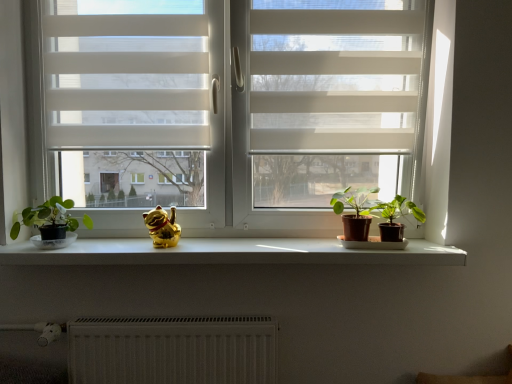
At what (x,y) coordinates should I click in order to perform the action: click on free space that is in between green matte plant at left, the first houseplant viewed from the left, and white matte window at center. Please return your answer as a coordinate pair (x, y). Image resolution: width=512 pixels, height=384 pixels. Looking at the image, I should click on (179, 249).